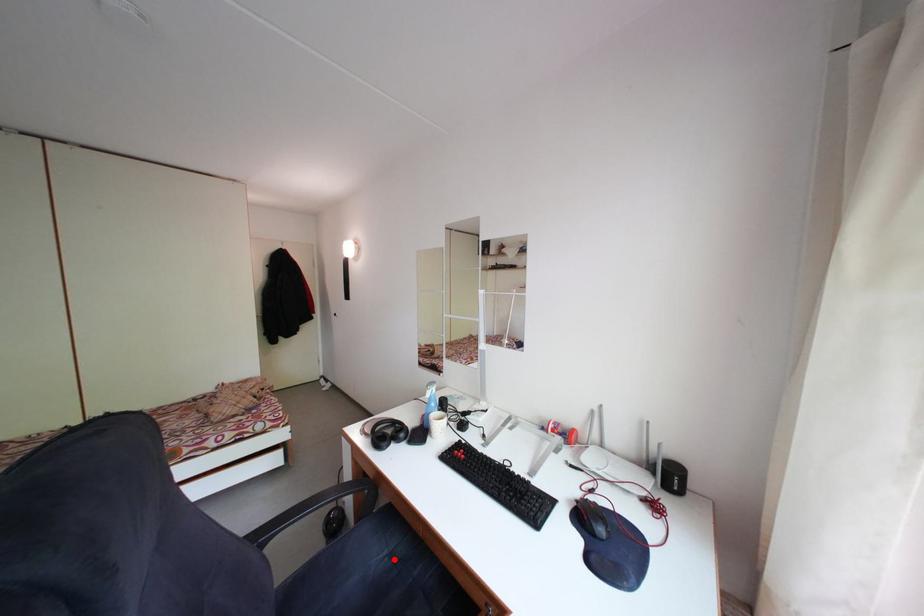
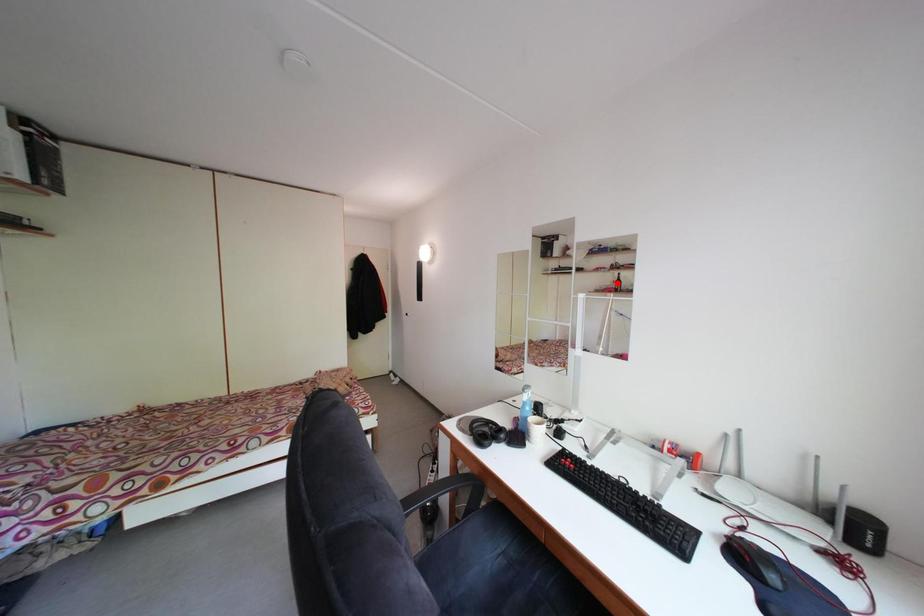
Looking at this image, I am providing you with two images of the same scene from different viewpoints. A red point is marked on the first image and another point is marked on the second image. Is the red point in image1 aligned with the point shown in image2?

No